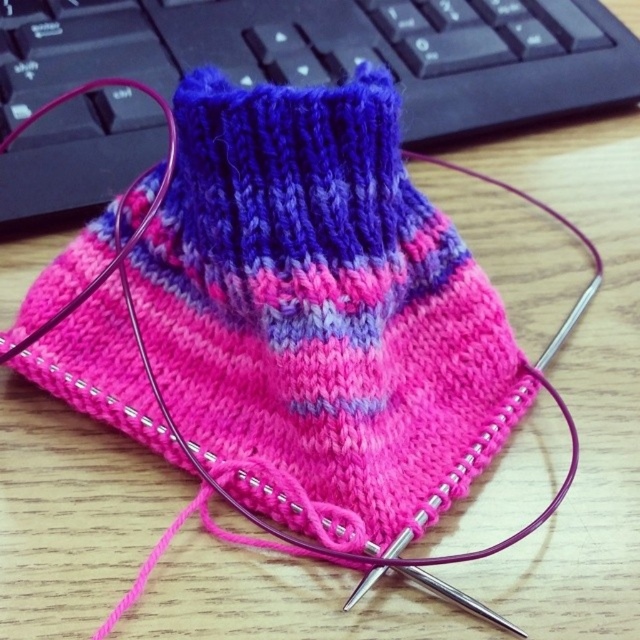
Question: Is pink yarn knit at center wider than matte black keyboard at upper center?

Choices:
 (A) no
 (B) yes

Answer: (A)

Question: Which point appears closest to the camera in this image?

Choices:
 (A) (472, 413)
 (B) (385, 42)

Answer: (A)

Question: Does pink yarn knit at center have a greater width compared to matte black keyboard at upper center?

Choices:
 (A) yes
 (B) no

Answer: (B)

Question: Can you confirm if pink yarn knit at center is positioned above matte black keyboard at upper center?

Choices:
 (A) yes
 (B) no

Answer: (B)

Question: Which point is farther from the camera taking this photo?

Choices:
 (A) (442, 259)
 (B) (388, 40)

Answer: (B)